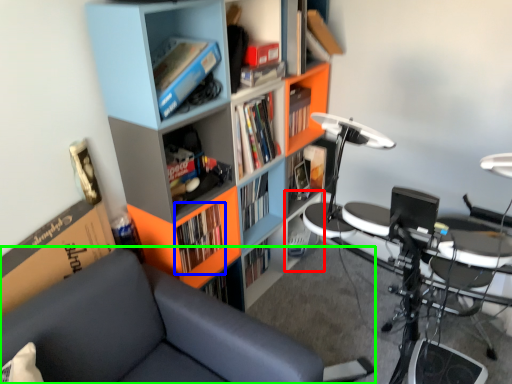
Question: Which object is the closest to the cabinet (highlighted by a red box)? Choose among these: book (highlighted by a blue box) or chair (highlighted by a green box).

Choices:
 (A) book
 (B) chair

Answer: (A)